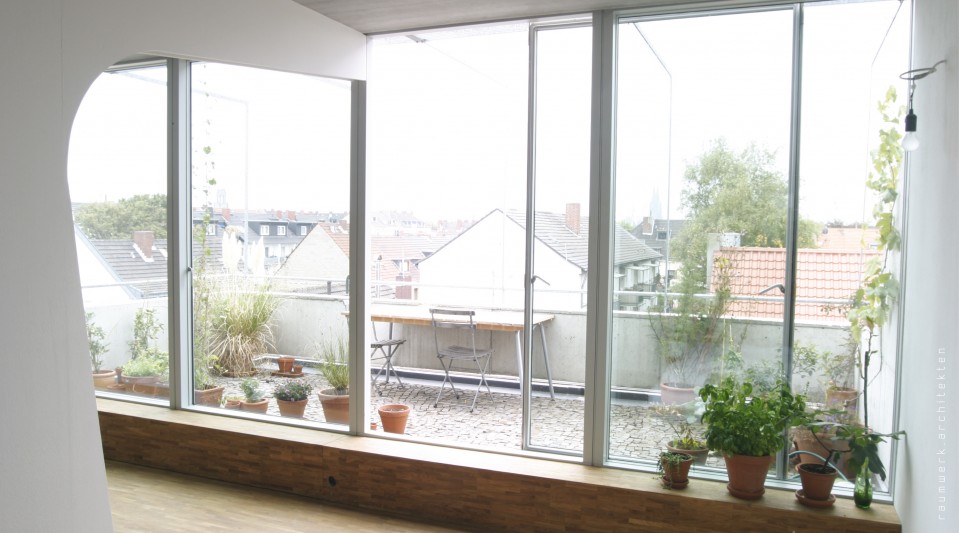
At what (x,y) coordinates should I click in order to perform the action: click on table. Please return your answer as a coordinate pair (x, y). Looking at the image, I should click on pyautogui.click(x=504, y=322).